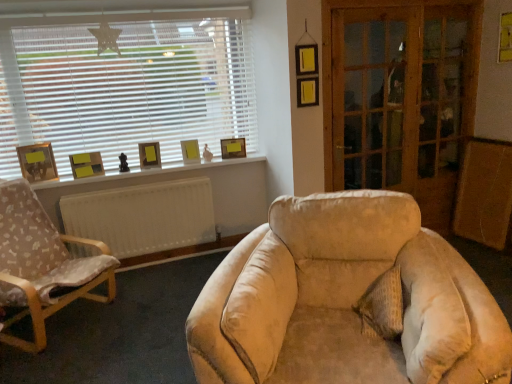
What do you see at coordinates (124, 83) in the screenshot? I see `white blinds at upper left` at bounding box center [124, 83].

At what (x,y) coordinates should I click in order to perform the action: click on wooden screen door at right, acting as the second screen door starting from the left. Please return your answer as a coordinate pair (x, y). This screenshot has width=512, height=384. Looking at the image, I should click on (400, 97).

This screenshot has width=512, height=384. What do you see at coordinates (147, 172) in the screenshot?
I see `yellow paper at upper center` at bounding box center [147, 172].

Locate an element on the screen. Image resolution: width=512 pixels, height=384 pixels. textured beige pillow at center is located at coordinates (382, 306).

The height and width of the screenshot is (384, 512). I want to click on wooden chair with fabric cushion at left, so click(42, 264).

Identify the location of white blinds at upper left. (124, 83).

Considering the relative sizes of matte wooden picture frame at left, the first picture frame when ordered from left to right, and wooden screen door at right, placed as the 1th screen door when sorted from right to left, in the image provided, is matte wooden picture frame at left, the first picture frame when ordered from left to right, taller than wooden screen door at right, placed as the 1th screen door when sorted from right to left,?

No, matte wooden picture frame at left, the first picture frame when ordered from left to right, is not taller than wooden screen door at right, placed as the 1th screen door when sorted from right to left.

From the image's perspective, between matte wooden picture frame at left, the first picture frame when ordered from left to right, and wooden screen door at right, placed as the 1th screen door when sorted from right to left, which one is located above?

wooden screen door at right, placed as the 1th screen door when sorted from right to left.

How many degrees apart are the facing directions of matte wooden picture frame at left, the first picture frame when ordered from left to right, and wooden screen door at right, acting as the second screen door starting from the left?

matte wooden picture frame at left, the first picture frame when ordered from left to right, and wooden screen door at right, acting as the second screen door starting from the left, are facing 7.23 degrees away from each other.

Can you confirm if textured beige pillow at center is taller than matte wooden picture frame at left, the first picture frame when ordered from left to right?

In fact, textured beige pillow at center may be shorter than matte wooden picture frame at left, the first picture frame when ordered from left to right.

Looking at the image, does textured beige pillow at center seem bigger or smaller compared to matte wooden picture frame at left, the first picture frame when ordered from left to right?

Clearly, textured beige pillow at center is larger in size than matte wooden picture frame at left, the first picture frame when ordered from left to right.

Can we say textured beige pillow at center lies outside matte wooden picture frame at left, the fifth picture frame from the right?

Absolutely, textured beige pillow at center is external to matte wooden picture frame at left, the fifth picture frame from the right.

From the picture: Is textured beige pillow at center closer to the viewer compared to matte wooden picture frame at left, the fifth picture frame from the right?

Yes.

Considering the relative sizes of wooden chair with fabric cushion at left and matte yellow picture frame at center, which ranks as the second picture frame in right-to-left order, in the image provided, is wooden chair with fabric cushion at left taller than matte yellow picture frame at center, which ranks as the second picture frame in right-to-left order,?

Yes, wooden chair with fabric cushion at left is taller than matte yellow picture frame at center, which ranks as the second picture frame in right-to-left order.

Is wooden chair with fabric cushion at left surrounding matte yellow picture frame at center, which ranks as the second picture frame in right-to-left order?

No, wooden chair with fabric cushion at left does not contain matte yellow picture frame at center, which ranks as the second picture frame in right-to-left order.

Identify the location of chair that appears on the left of matte yellow picture frame at center, which is the 4th picture frame in left-to-right order. (42, 264).

Is wooden chair with fabric cushion at left positioned with its back to matte yellow picture frame at center, which ranks as the second picture frame in right-to-left order?

No.

Between yellow paper at upper right and matte yellow picture frame at upper left, which ranks as the second picture frame in left-to-right order, which one has larger width?

Wider between the two is matte yellow picture frame at upper left, which ranks as the second picture frame in left-to-right order.

From a real-world perspective, which object stands above the other?

In real-world perspective, yellow paper at upper right is above.

Looking at this image, is yellow paper at upper right directly adjacent to matte yellow picture frame at upper left, the 4th picture frame positioned from the right?

No, yellow paper at upper right is not making contact with matte yellow picture frame at upper left, the 4th picture frame positioned from the right.

Could you tell me if yellow paper at upper right is facing matte yellow picture frame at upper left, the 4th picture frame positioned from the right?

Yes, yellow paper at upper right is facing matte yellow picture frame at upper left, the 4th picture frame positioned from the right.

How distant is matte wooden picture frame at left, the first picture frame when ordered from left to right, from textured beige pillow at center?

The distance of matte wooden picture frame at left, the first picture frame when ordered from left to right, from textured beige pillow at center is 8.79 feet.

Between matte wooden picture frame at left, the fifth picture frame from the right, and textured beige pillow at center, which one has larger size?

With larger size is textured beige pillow at center.

Considering the relative sizes of matte wooden picture frame at left, the first picture frame when ordered from left to right, and textured beige pillow at center in the image provided, is matte wooden picture frame at left, the first picture frame when ordered from left to right, taller than textured beige pillow at center?

Yes, matte wooden picture frame at left, the first picture frame when ordered from left to right, is taller than textured beige pillow at center.

Is matte wooden picture frame at left, the fifth picture frame from the right, wider or thinner than textured beige pillow at center?

Clearly, matte wooden picture frame at left, the fifth picture frame from the right, has less width compared to textured beige pillow at center.

Does matte yellow picture frame at upper left, the 4th picture frame positioned from the right, lie in front of yellow paper at upper center?

No, matte yellow picture frame at upper left, the 4th picture frame positioned from the right, is behind yellow paper at upper center.

Is matte yellow picture frame at upper left, which ranks as the second picture frame in left-to-right order, spatially inside yellow paper at upper center, or outside of it?

matte yellow picture frame at upper left, which ranks as the second picture frame in left-to-right order, is not inside yellow paper at upper center, it's outside.

Is matte yellow picture frame at upper left, which ranks as the second picture frame in left-to-right order, turned away from yellow paper at upper center?

No, yellow paper at upper center is not at the back of matte yellow picture frame at upper left, which ranks as the second picture frame in left-to-right order.

Does matte yellow picture frame at upper left, the 4th picture frame positioned from the right, have a larger size compared to yellow paper at upper center?

Incorrect, matte yellow picture frame at upper left, the 4th picture frame positioned from the right, is not larger than yellow paper at upper center.

From a real-world perspective, who is located higher, matte yellow picture frame at window, which ranks as the 3th picture frame in right-to-left order, or matte yellow picture frame at upper left, the 4th picture frame positioned from the right?

matte yellow picture frame at window, which ranks as the 3th picture frame in right-to-left order.

How many degrees apart are the facing directions of matte yellow picture frame at window, which ranks as the 3th picture frame in right-to-left order, and matte yellow picture frame at upper left, which ranks as the second picture frame in left-to-right order?

matte yellow picture frame at window, which ranks as the 3th picture frame in right-to-left order, and matte yellow picture frame at upper left, which ranks as the second picture frame in left-to-right order, are facing 19.4 degrees away from each other.

Who is bigger, matte yellow picture frame at window, the 3th picture frame when ordered from left to right, or matte yellow picture frame at upper left, the 4th picture frame positioned from the right?

Bigger between the two is matte yellow picture frame at upper left, the 4th picture frame positioned from the right.

Does matte yellow picture frame at window, the 3th picture frame when ordered from left to right, touch matte yellow picture frame at upper left, the 4th picture frame positioned from the right?

No.

From the image's perspective, starting from the matte wooden picture frame at left, the fifth picture frame from the right, which screen door is the 2nd one above? Please provide its 2D coordinates.

[(400, 97)]

The width and height of the screenshot is (512, 384). Find the location of `pillow that is on the right side of matte wooden picture frame at left, the fifth picture frame from the right`. pillow that is on the right side of matte wooden picture frame at left, the fifth picture frame from the right is located at coordinates (382, 306).

Considering their positions, is wooden chair with fabric cushion at left positioned further to yellow paper at upper right than matte wooden picture frame at left, the fifth picture frame from the right?

matte wooden picture frame at left, the fifth picture frame from the right, is further to yellow paper at upper right.

Based on their spatial positions, is matte yellow picture frame at center, which is the 4th picture frame in left-to-right order, or matte yellow picture frame at window, which ranks as the 3th picture frame in right-to-left order, closer to textured beige pillow at center?

matte yellow picture frame at center, which is the 4th picture frame in left-to-right order, lies closer to textured beige pillow at center than the other object.

Looking at this image, based on their spatial positions, is matte wooden picture frame at left, the first picture frame when ordered from left to right, or wooden chair with fabric cushion at left further from white blinds at upper left?

wooden chair with fabric cushion at left.

Based on their spatial positions, is wooden chair with fabric cushion at left or wooden screen door at right, acting as the second screen door starting from the left, closer to yellow paper at upper center?

wooden chair with fabric cushion at left.

Looking at the image, which one is located further to yellow paper at upper center, wooden glass screen door at right, which is counted as the second screen door, starting from the right, or textured beige pillow at center?

textured beige pillow at center.

Looking at the image, which one is located further to yellow paper at upper right, wooden chair with fabric cushion at left or wooden screen door at right, placed as the 1th screen door when sorted from right to left?

wooden chair with fabric cushion at left is further to yellow paper at upper right.

Looking at the image, which one is located further to matte yellow picture frame at center, which ranks as the second picture frame in right-to-left order, white blinds at upper left or yellow paper at upper center?

white blinds at upper left is further to matte yellow picture frame at center, which ranks as the second picture frame in right-to-left order.

From the image, which object appears to be farther from matte yellow picture frame at upper left, the 4th picture frame positioned from the right, matte wooden picture frame at left, the fifth picture frame from the right, or yellow paper at upper center?

Among the two, yellow paper at upper center is located further to matte yellow picture frame at upper left, the 4th picture frame positioned from the right.

Image resolution: width=512 pixels, height=384 pixels. Find the location of `pillow between matte yellow picture frame at window, which ranks as the 3th picture frame in right-to-left order, and wooden screen door at right, acting as the second screen door starting from the left, in the horizontal direction`. pillow between matte yellow picture frame at window, which ranks as the 3th picture frame in right-to-left order, and wooden screen door at right, acting as the second screen door starting from the left, in the horizontal direction is located at coordinates (382, 306).

Locate an element on the screen. Image resolution: width=512 pixels, height=384 pixels. screen door between matte yellow picture frame at center, which ranks as the second picture frame in right-to-left order, and wooden screen door at right, acting as the second screen door starting from the left is located at coordinates (373, 97).

Find the location of a particular element. picture frame between matte yellow picture frame at upper left, the 4th picture frame positioned from the right, and matte yellow picture frame at center, which ranks as the second picture frame in right-to-left order, from left to right is located at coordinates (149, 154).

Locate an element on the screen. window sill between white blinds at upper left and textured beige pillow at center is located at coordinates (147, 172).